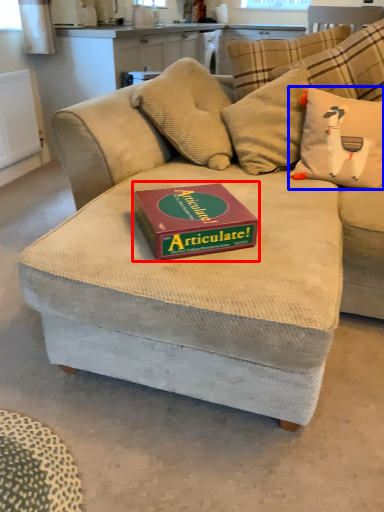
Question: Among these objects, which one is nearest to the camera, paperback book (highlighted by a red box) or throw pillow (highlighted by a blue box)?

Choices:
 (A) paperback book
 (B) throw pillow

Answer: (A)